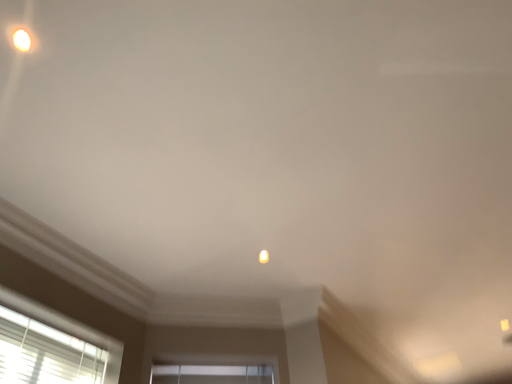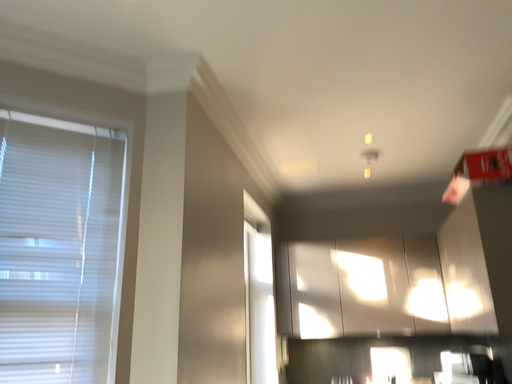
Question: How did the camera likely rotate when shooting the video?

Choices:
 (A) rotated left
 (B) rotated right

Answer: (B)